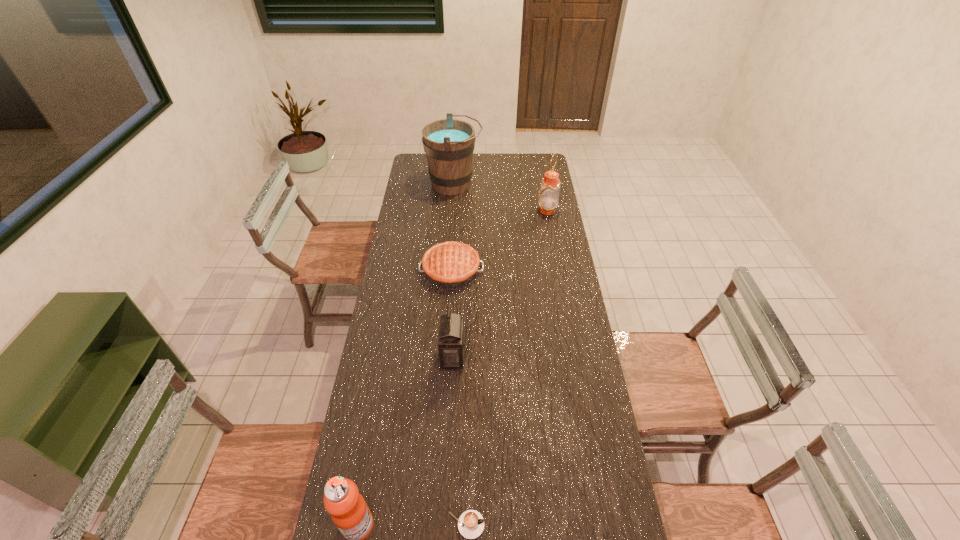
At what (x,y) coordinates should I click in order to perform the action: click on free point located 0.080m on the front of the pie. Please return your answer as a coordinate pair (x, y). The width and height of the screenshot is (960, 540). Looking at the image, I should click on (449, 305).

This screenshot has width=960, height=540. What are the coordinates of `vacant position located with the handle on the side of the cappuccino` in the screenshot? It's located at [577, 525].

This screenshot has height=540, width=960. What are the coordinates of `object at the far edge` in the screenshot? It's located at (449, 143).

At what (x,y) coordinates should I click in order to perform the action: click on wine bucket present at the left edge. Please return your answer as a coordinate pair (x, y). Looking at the image, I should click on (449, 143).

This screenshot has width=960, height=540. I want to click on pie present at the left edge, so click(451, 264).

Find the location of a particular element. The image size is (960, 540). object that is at the right edge is located at coordinates (549, 191).

Identify the location of object that is positioned at the far left corner. The image size is (960, 540). (449, 143).

You are a GUI agent. You are given a task and a screenshot of the screen. Output one action in this format:
    pyautogui.click(x=<x>, y=<y>)
    Task: Click on the free space at the left edge
    The width and height of the screenshot is (960, 540).
    Given the screenshot: What is the action you would take?
    pyautogui.click(x=399, y=292)

In the image, there is a desktop. Identify the location of vacant area at the right edge. The width and height of the screenshot is (960, 540). (562, 326).

I want to click on vacant area that lies between the oil lamp and the pie, so click(499, 240).